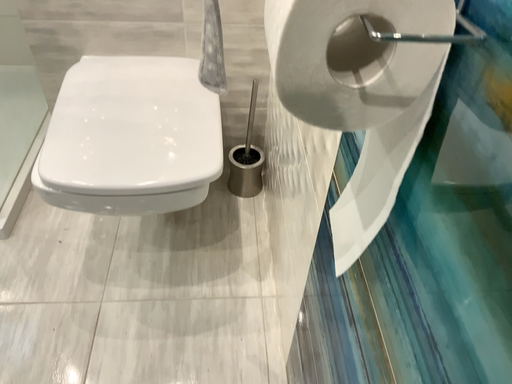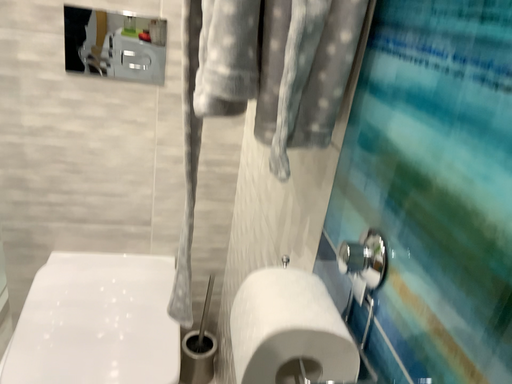
Question: How did the camera likely rotate when shooting the video?

Choices:
 (A) rotated upward
 (B) rotated downward

Answer: (A)